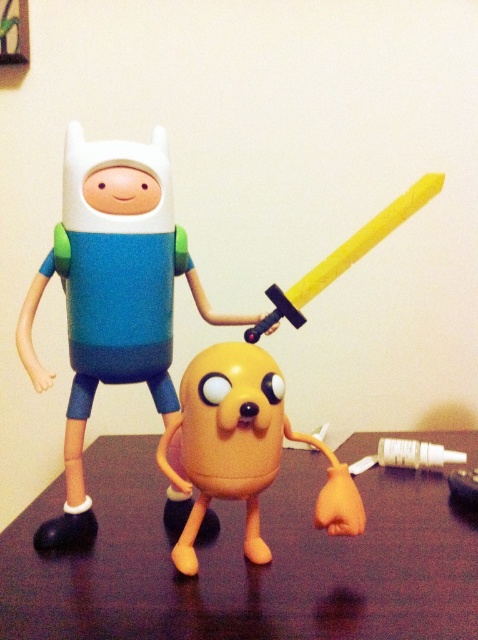
You are a collector who wants to place a new 20 cm tall Adventure Time figurine on the brown wooden table at center. The matte plastic figure at center is currently occupying space on the table. Can you fit the new figurine next to the existing one without moving it?

The brown wooden table at center is closer to the viewer than the matte plastic figure at center, which means the figure is placed further back on the table. Since the table has space to the sides of the figure, you can likely fit the new 20 cm tall figurine next to the matte plastic figure at center without moving it.